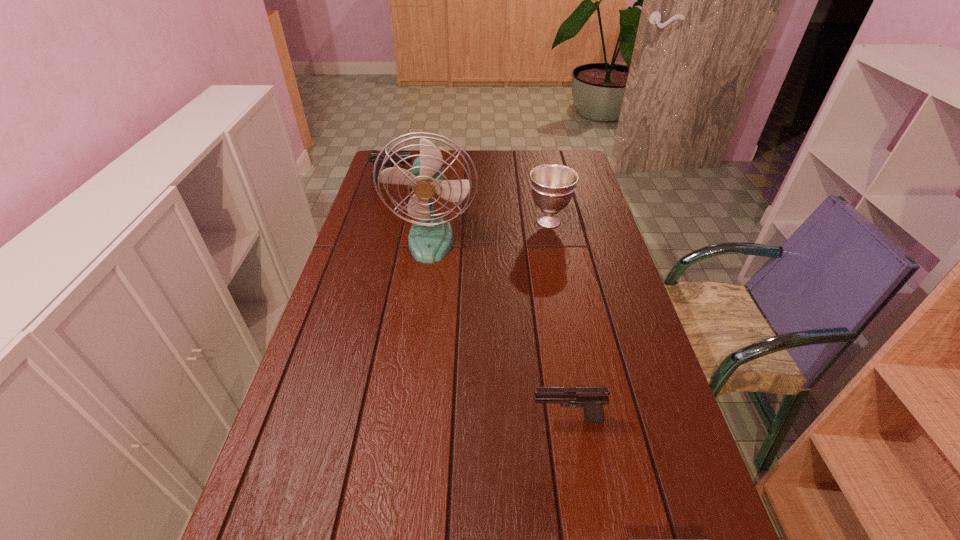
Where is `blank space located aim along the barrel of the second farthest pistol`? The width and height of the screenshot is (960, 540). blank space located aim along the barrel of the second farthest pistol is located at coordinates click(405, 420).

Locate an element on the screen. fan present at the left edge is located at coordinates (430, 238).

Locate an element on the screen. This screenshot has height=540, width=960. pistol situated at the left edge is located at coordinates (373, 156).

Locate an element on the screen. chalice that is positioned at the right edge is located at coordinates (552, 185).

Image resolution: width=960 pixels, height=540 pixels. I want to click on pistol that is at the right edge, so click(x=592, y=399).

Identify the location of vacant region at the left edge. (350, 389).

In the image, there is a desktop. Where is `vacant space at the right edge`? The width and height of the screenshot is (960, 540). vacant space at the right edge is located at coordinates (619, 399).

I want to click on free spot between the fan and the fourth farthest object, so click(x=499, y=330).

I want to click on vacant space in between the farthest pistol and the fourth farthest object, so pyautogui.click(x=480, y=300).

This screenshot has height=540, width=960. Find the location of `vacant area between the farthest object and the second nearest pistol`. vacant area between the farthest object and the second nearest pistol is located at coordinates (480, 300).